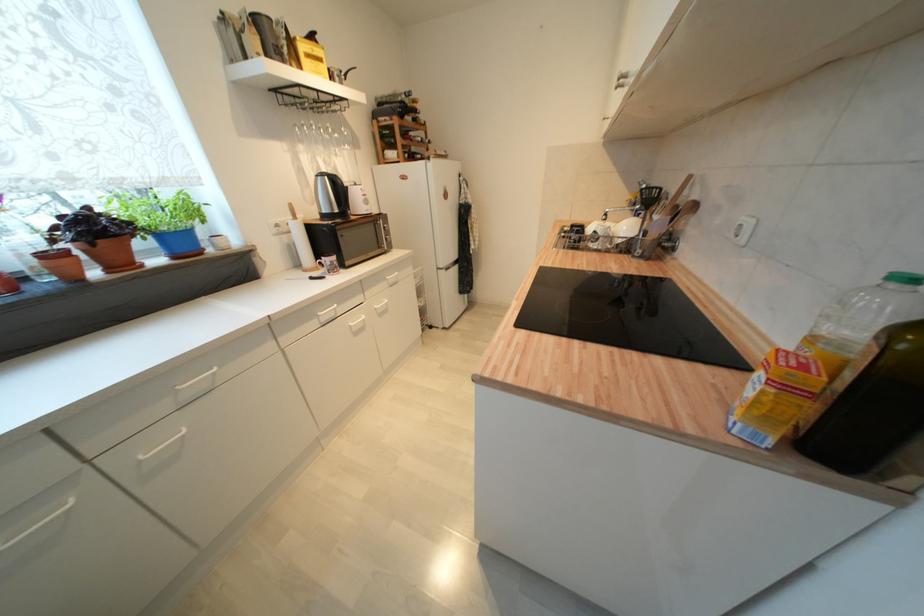
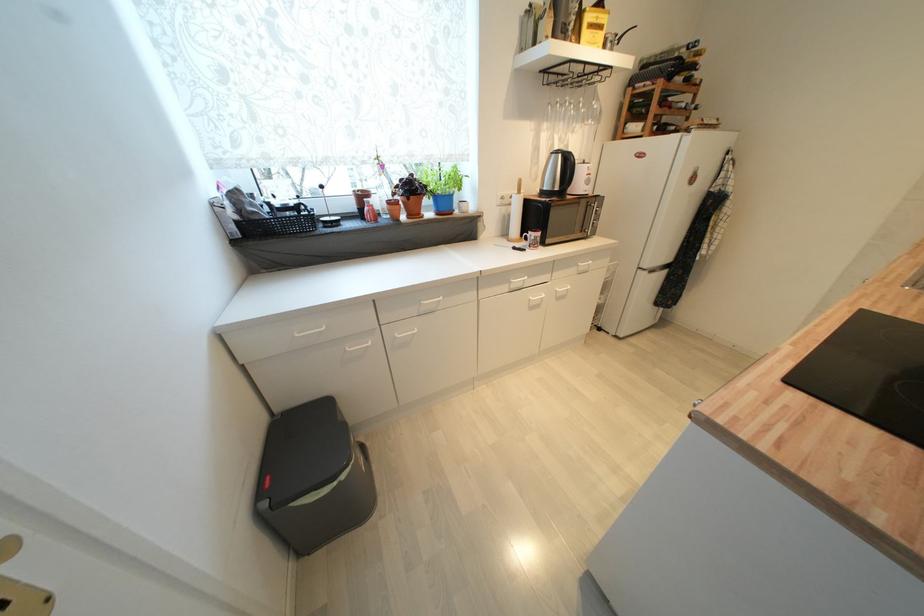
In the second image, find the point that corresponds to pixel 306 148 in the first image.

(551, 127)